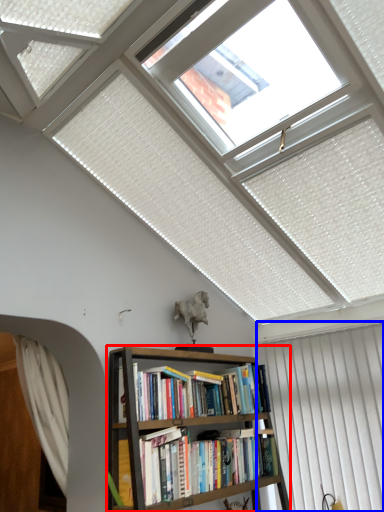
Question: Among these objects, which one is nearest to the camera, bookcase (highlighted by a red box) or curtain (highlighted by a blue box)?

Choices:
 (A) bookcase
 (B) curtain

Answer: (A)